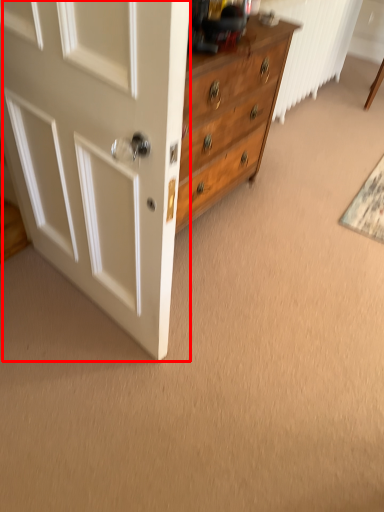
Question: From the image's perspective, what is the correct spatial positioning of door (annotated by the red box) in reference to doormat?

Choices:
 (A) below
 (B) above

Answer: (A)